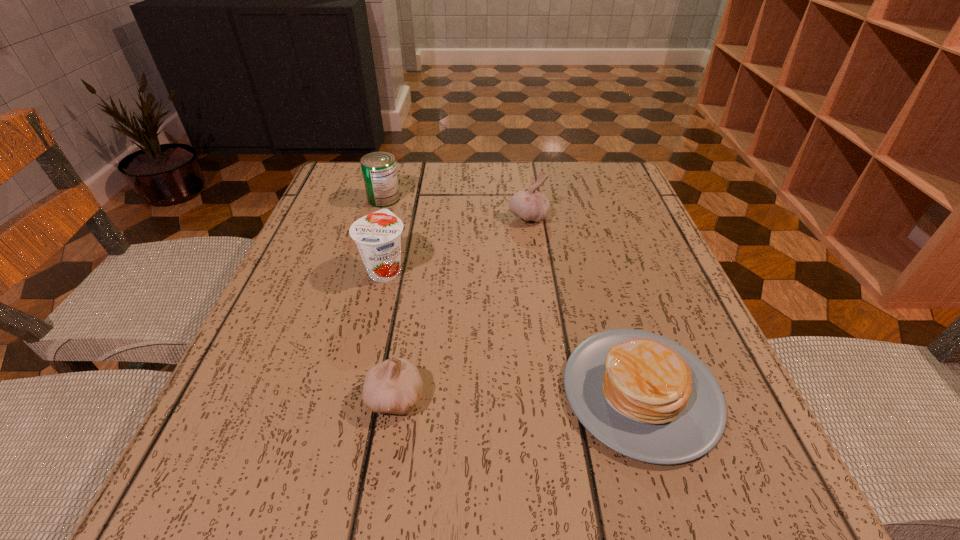
You are a GUI agent. You are given a task and a screenshot of the screen. Output one action in this format:
    pyautogui.click(x=<x>, y=<y>)
    Task: Click on the farther garlic
    
    Given the screenshot: What is the action you would take?
    pyautogui.click(x=530, y=205)

Find the location of a particular element. the right garlic is located at coordinates click(530, 205).

Where is `can`? can is located at coordinates (379, 171).

Where is `the third nearest object`? the third nearest object is located at coordinates (378, 235).

The width and height of the screenshot is (960, 540). Find the location of `the nearer garlic`. the nearer garlic is located at coordinates (394, 386).

The image size is (960, 540). In order to click on the shorter garlic in this screenshot , I will do `click(394, 386)`.

Identify the location of pancake. The height and width of the screenshot is (540, 960). (646, 397).

The height and width of the screenshot is (540, 960). What are the coordinates of `vacant area located 0.280m on the left of the farther garlic` in the screenshot? It's located at (384, 217).

The height and width of the screenshot is (540, 960). What are the coordinates of `free space located on the right of the can` in the screenshot? It's located at (501, 199).

Locate an element on the screen. free spot located on the back of the third farthest object is located at coordinates (409, 170).